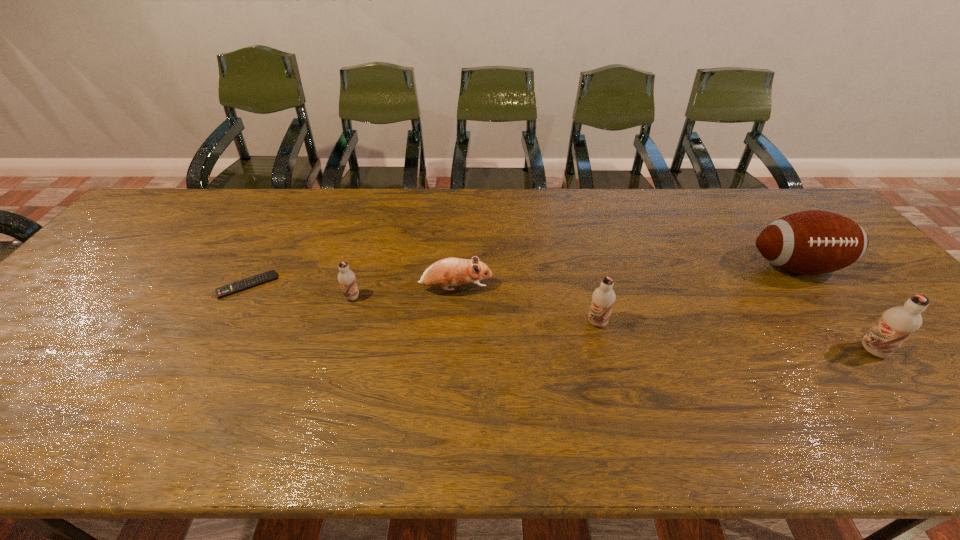
The image size is (960, 540). In order to click on the leftmost chocolate milk in this screenshot , I will do pyautogui.click(x=346, y=277).

The height and width of the screenshot is (540, 960). Identify the location of the farthest chocolate milk. (346, 277).

Find the location of a particular element. The height and width of the screenshot is (540, 960). the second nearest chocolate milk is located at coordinates (603, 298).

I want to click on the second chocolate milk from left to right, so click(603, 298).

You are a GUI agent. You are given a task and a screenshot of the screen. Output one action in this format:
    pyautogui.click(x=<x>, y=<y>)
    Task: Click on the tallest chocolate milk
    The height and width of the screenshot is (540, 960).
    Given the screenshot: What is the action you would take?
    click(896, 324)

Image resolution: width=960 pixels, height=540 pixels. I want to click on the nearest object, so click(x=896, y=324).

The height and width of the screenshot is (540, 960). I want to click on hamster, so click(452, 271).

The width and height of the screenshot is (960, 540). Find the location of `the fourth object from right to left`. the fourth object from right to left is located at coordinates (452, 271).

Identify the location of the shortest object. (254, 281).

The image size is (960, 540). Identify the location of the leftmost object. (254, 281).